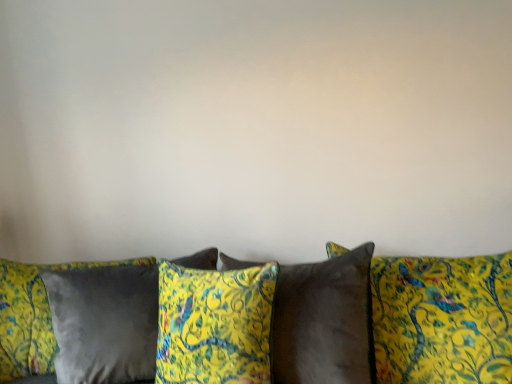
In order to click on velvet yellow pillow at center, positioned as the second pillow in right-to-left order in this screenshot , I will do `click(324, 321)`.

How much space does velvet yellow pillow at center, which ranks as the 3th pillow in left-to-right order, occupy horizontally?

velvet yellow pillow at center, which ranks as the 3th pillow in left-to-right order, is 12.90 inches wide.

This screenshot has width=512, height=384. In order to click on satin brown pillow at center, which appears as the 1th pillow when viewed from the right in this screenshot , I will do `click(442, 319)`.

Where is `velvet yellow pillow at center, which ranks as the 2th pillow in left-to-right order`? Image resolution: width=512 pixels, height=384 pixels. velvet yellow pillow at center, which ranks as the 2th pillow in left-to-right order is located at coordinates (214, 325).

Looking at this image, considering the relative positions of velvet yellow pillow at center, positioned as the second pillow in right-to-left order, and velvet yellow pillows at center in the image provided, is velvet yellow pillow at center, positioned as the second pillow in right-to-left order, in front of velvet yellow pillows at center?

No.

In the scene shown: How different are the orientations of velvet yellow pillow at center, which ranks as the 3th pillow in left-to-right order, and velvet yellow pillows at center in degrees?

27.8 degrees.

Is velvet yellow pillow at center, which ranks as the 3th pillow in left-to-right order, bigger than velvet yellow pillows at center?

No, velvet yellow pillow at center, which ranks as the 3th pillow in left-to-right order, is not bigger than velvet yellow pillows at center.

Considering the sizes of objects velvet yellow pillow at center, positioned as the second pillow in right-to-left order, and velvet yellow pillows at center in the image provided, who is thinner, velvet yellow pillow at center, positioned as the second pillow in right-to-left order, or velvet yellow pillows at center?

Thinner between the two is velvet yellow pillow at center, positioned as the second pillow in right-to-left order.

From the picture: From the image's perspective, does velvet yellow pillows at center appear higher than velvet yellow pillow at center, which ranks as the 3th pillow in right-to-left order?

Actually, velvet yellow pillows at center appears below velvet yellow pillow at center, which ranks as the 3th pillow in right-to-left order, in the image.

Considering the relative positions of velvet yellow pillows at center and velvet yellow pillow at center, which ranks as the 2th pillow in left-to-right order, in the image provided, is velvet yellow pillows at center in front of velvet yellow pillow at center, which ranks as the 2th pillow in left-to-right order,?

Yes, it is in front of velvet yellow pillow at center, which ranks as the 2th pillow in left-to-right order.

Considering the relative sizes of velvet yellow pillows at center and velvet yellow pillow at center, which ranks as the 3th pillow in right-to-left order, in the image provided, is velvet yellow pillows at center bigger than velvet yellow pillow at center, which ranks as the 3th pillow in right-to-left order,?

Yes, velvet yellow pillows at center is bigger than velvet yellow pillow at center, which ranks as the 3th pillow in right-to-left order.

Is satin brown pillow at center, the 4th pillow positioned from the left, facing towards velvet yellow pillow at center, which ranks as the 3th pillow in left-to-right order?

Yes, satin brown pillow at center, the 4th pillow positioned from the left, is oriented towards velvet yellow pillow at center, which ranks as the 3th pillow in left-to-right order.

Looking at this image, considering the relative sizes of satin brown pillow at center, the 4th pillow positioned from the left, and velvet yellow pillow at center, positioned as the second pillow in right-to-left order, in the image provided, is satin brown pillow at center, the 4th pillow positioned from the left, smaller than velvet yellow pillow at center, positioned as the second pillow in right-to-left order,?

Incorrect, satin brown pillow at center, the 4th pillow positioned from the left, is not smaller in size than velvet yellow pillow at center, positioned as the second pillow in right-to-left order.

How many degrees apart are the facing directions of satin brown pillow at center, the 4th pillow positioned from the left, and velvet yellow pillow at center, positioned as the second pillow in right-to-left order?

satin brown pillow at center, the 4th pillow positioned from the left, and velvet yellow pillow at center, positioned as the second pillow in right-to-left order, are facing 12 degrees away from each other.

Does satin brown pillow at center, which appears as the 1th pillow when viewed from the right, have a lesser width compared to velvet yellow pillow at center, which ranks as the 3th pillow in left-to-right order?

No.

In the image, is satin gray pillow at lower left, the 4th pillow positioned from the right, positioned in front of or behind satin brown pillow at center, which appears as the 1th pillow when viewed from the right?

In the image, satin gray pillow at lower left, the 4th pillow positioned from the right, appears behind satin brown pillow at center, which appears as the 1th pillow when viewed from the right.

Which point is more distant from viewer, (74, 360) or (492, 260)?

Point (74, 360)

Is satin gray pillow at lower left, the 4th pillow positioned from the right, next to satin brown pillow at center, the 4th pillow positioned from the left, and touching it?

No, satin gray pillow at lower left, the 4th pillow positioned from the right, is not making contact with satin brown pillow at center, the 4th pillow positioned from the left.

Where is `the 2nd pillow behind the satin brown pillow at center, the 4th pillow positioned from the left`? Image resolution: width=512 pixels, height=384 pixels. the 2nd pillow behind the satin brown pillow at center, the 4th pillow positioned from the left is located at coordinates (104, 323).

Can you confirm if satin brown pillow at center, the 4th pillow positioned from the left, is bigger than satin gray pillow at lower left, the 4th pillow positioned from the right?

Correct, satin brown pillow at center, the 4th pillow positioned from the left, is larger in size than satin gray pillow at lower left, the 4th pillow positioned from the right.

Considering the relative positions of satin brown pillow at center, the 4th pillow positioned from the left, and satin gray pillow at lower left, the 4th pillow positioned from the right, in the image provided, is satin brown pillow at center, the 4th pillow positioned from the left, to the left of satin gray pillow at lower left, the 4th pillow positioned from the right, from the viewer's perspective?

In fact, satin brown pillow at center, the 4th pillow positioned from the left, is to the right of satin gray pillow at lower left, the 4th pillow positioned from the right.

Is satin brown pillow at center, which appears as the 1th pillow when viewed from the right, far away from satin gray pillow at lower left, the first pillow viewed from the left?

That's not correct — satin brown pillow at center, which appears as the 1th pillow when viewed from the right, is a little close to satin gray pillow at lower left, the first pillow viewed from the left.

Based on the photo, considering the sizes of velvet yellow pillow at center, which ranks as the 3th pillow in left-to-right order, and satin brown pillow at center, which appears as the 1th pillow when viewed from the right, in the image, is velvet yellow pillow at center, which ranks as the 3th pillow in left-to-right order, wider or thinner than satin brown pillow at center, which appears as the 1th pillow when viewed from the right,?

velvet yellow pillow at center, which ranks as the 3th pillow in left-to-right order, is thinner than satin brown pillow at center, which appears as the 1th pillow when viewed from the right.

Considering the points (280, 349) and (460, 328), which point is behind, point (280, 349) or point (460, 328)?

The point (280, 349) is behind.

Is velvet yellow pillow at center, positioned as the second pillow in right-to-left order, not close to satin brown pillow at center, the 4th pillow positioned from the left?

No, velvet yellow pillow at center, positioned as the second pillow in right-to-left order, is in close proximity to satin brown pillow at center, the 4th pillow positioned from the left.

Locate an element on the screen. pillow that is the 3rd object to the right of the velvet yellow pillows at center, starting at the anchor is located at coordinates (442, 319).

Considering the relative sizes of velvet yellow pillows at center and satin brown pillow at center, the 4th pillow positioned from the left, in the image provided, is velvet yellow pillows at center bigger than satin brown pillow at center, the 4th pillow positioned from the left,?

Yes, velvet yellow pillows at center is bigger than satin brown pillow at center, the 4th pillow positioned from the left.

This screenshot has width=512, height=384. What are the coordinates of `studio couch lying in front of the velvet yellow pillow at center, positioned as the second pillow in right-to-left order` in the screenshot? It's located at (443, 319).

At what (x,y) coordinates should I click in order to perform the action: click on studio couch below the velvet yellow pillow at center, which ranks as the 3th pillow in right-to-left order (from the image's perspective). Please return your answer as a coordinate pair (x, y). The width and height of the screenshot is (512, 384). Looking at the image, I should click on (443, 319).

Considering their positions, is velvet yellow pillow at center, which ranks as the 3th pillow in right-to-left order, positioned closer to satin brown pillow at center, which appears as the 1th pillow when viewed from the right, than satin gray pillow at lower left, the first pillow viewed from the left?

velvet yellow pillow at center, which ranks as the 3th pillow in right-to-left order, lies closer to satin brown pillow at center, which appears as the 1th pillow when viewed from the right, than the other object.

Based on their spatial positions, is velvet yellow pillows at center or satin brown pillow at center, which appears as the 1th pillow when viewed from the right, closer to satin gray pillow at lower left, the 4th pillow positioned from the right?

The object closer to satin gray pillow at lower left, the 4th pillow positioned from the right, is velvet yellow pillows at center.

Which object lies further to the anchor point satin brown pillow at center, which appears as the 1th pillow when viewed from the right, satin gray pillow at lower left, the first pillow viewed from the left, or velvet yellow pillows at center?

Based on the image, satin gray pillow at lower left, the first pillow viewed from the left, appears to be further to satin brown pillow at center, which appears as the 1th pillow when viewed from the right.

Looking at the image, which one is located further to satin gray pillow at lower left, the first pillow viewed from the left, velvet yellow pillows at center or velvet yellow pillow at center, which ranks as the 2th pillow in left-to-right order?

velvet yellow pillows at center lies further to satin gray pillow at lower left, the first pillow viewed from the left, than the other object.

Considering their positions, is satin brown pillow at center, the 4th pillow positioned from the left, positioned closer to satin gray pillow at lower left, the first pillow viewed from the left, than velvet yellow pillow at center, which ranks as the 3th pillow in right-to-left order?

The object closer to satin gray pillow at lower left, the first pillow viewed from the left, is velvet yellow pillow at center, which ranks as the 3th pillow in right-to-left order.

Considering their positions, is velvet yellow pillow at center, which ranks as the 3th pillow in right-to-left order, positioned further to velvet yellow pillows at center than satin gray pillow at lower left, the first pillow viewed from the left?

Among the two, satin gray pillow at lower left, the first pillow viewed from the left, is located further to velvet yellow pillows at center.

From the picture: Looking at the image, which one is located further to velvet yellow pillows at center, satin brown pillow at center, which appears as the 1th pillow when viewed from the right, or velvet yellow pillow at center, which ranks as the 2th pillow in left-to-right order?

Among the two, velvet yellow pillow at center, which ranks as the 2th pillow in left-to-right order, is located further to velvet yellow pillows at center.

Looking at the image, which one is located closer to satin gray pillow at lower left, the 4th pillow positioned from the right, velvet yellow pillow at center, which ranks as the 3th pillow in right-to-left order, or satin brown pillow at center, which appears as the 1th pillow when viewed from the right?

The object closer to satin gray pillow at lower left, the 4th pillow positioned from the right, is velvet yellow pillow at center, which ranks as the 3th pillow in right-to-left order.

In order to click on studio couch located between satin gray pillow at lower left, the 4th pillow positioned from the right, and satin brown pillow at center, which appears as the 1th pillow when viewed from the right, in the left-right direction in this screenshot , I will do `click(443, 319)`.

Identify the location of pillow situated between satin gray pillow at lower left, the first pillow viewed from the left, and velvet yellow pillow at center, positioned as the second pillow in right-to-left order, from left to right. (214, 325).

At what (x,y) coordinates should I click in order to perform the action: click on pillow between velvet yellow pillow at center, which ranks as the 3th pillow in right-to-left order, and satin brown pillow at center, the 4th pillow positioned from the left. Please return your answer as a coordinate pair (x, y). Looking at the image, I should click on (324, 321).